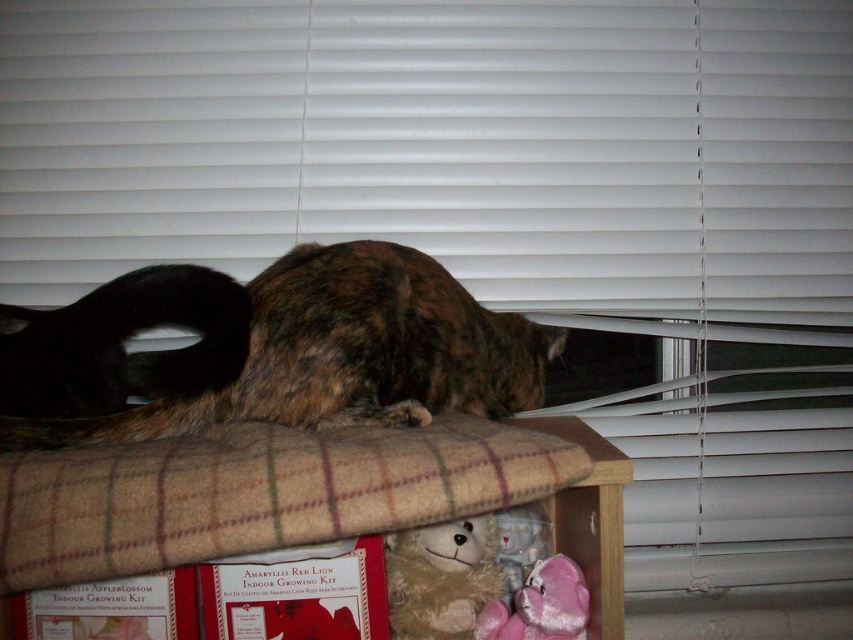
Which is more to the right, velvet pink teddy bear at lower right or fuzzy fabric teddy bear at lower center?

Positioned to the right is velvet pink teddy bear at lower right.

Is velvet pink teddy bear at lower right closer to camera compared to fuzzy fabric teddy bear at lower center?

That is True.

Which is in front, point (523, 595) or point (538, 525)?

Point (523, 595) is more forward.

Where is `velvet pink teddy bear at lower right`? Image resolution: width=853 pixels, height=640 pixels. velvet pink teddy bear at lower right is located at coordinates (540, 605).

Does fluffy beige teddy bear at lower center have a smaller size compared to velvet pink teddy bear at lower right?

Actually, fluffy beige teddy bear at lower center might be larger than velvet pink teddy bear at lower right.

Which is above, fluffy beige teddy bear at lower center or velvet pink teddy bear at lower right?

Positioned higher is fluffy beige teddy bear at lower center.

Which is behind, point (389, 584) or point (550, 600)?

Point (389, 584)

What are the coordinates of `fluffy beige teddy bear at lower center` in the screenshot? It's located at (440, 577).

Is brown fur cat at center bigger than velvet pink teddy bear at lower right?

Yes, brown fur cat at center is bigger than velvet pink teddy bear at lower right.

Is brown fur cat at center thinner than velvet pink teddy bear at lower right?

Incorrect, brown fur cat at center's width is not less than velvet pink teddy bear at lower right's.

What are the coordinates of `brown fur cat at center` in the screenshot? It's located at (328, 353).